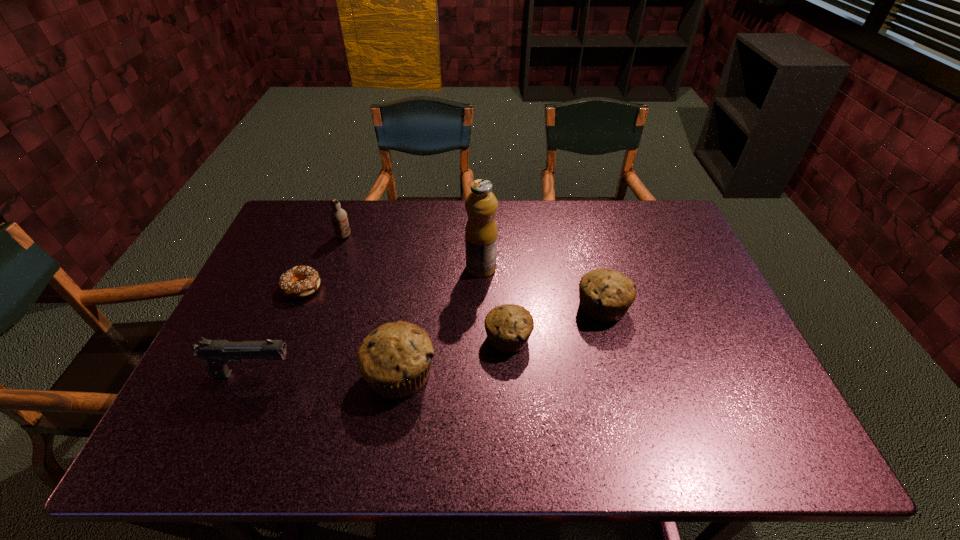
Locate an element on the screen. The width and height of the screenshot is (960, 540). vacant region that satisfies the following two spatial constraints: 1. on the back side of the rightmost muffin; 2. on the right side of the leftmost muffin is located at coordinates (410, 307).